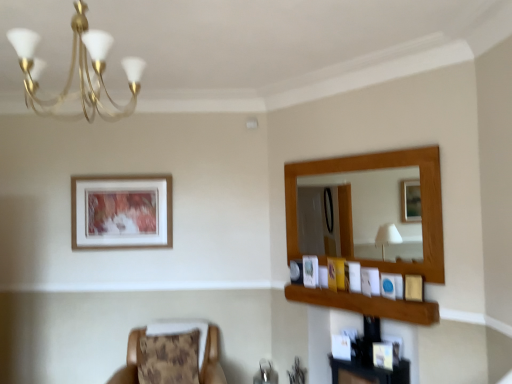
Question: From their relative heights in the image, would you say wooden picture frame at right, marked as the fourth picture frame in a left-to-right arrangement, is taller or shorter than brown textured cushion at lower left?

Choices:
 (A) tall
 (B) short

Answer: (B)

Question: Based on their sizes in the image, would you say wooden picture frame at right, which is the third picture frame in right-to-left order, is bigger or smaller than brown textured cushion at lower left?

Choices:
 (A) big
 (B) small

Answer: (B)

Question: Which is farther from the wooden framed artwork at upper left, acting as the first picture frame starting from the left?

Choices:
 (A) matte gold picture frame at right, arranged as the 1th picture frame when viewed from the front
 (B) gold metallic chandelier at upper left
 (C) matte white picture frame at upper center, placed as the fifth picture frame when sorted from right to left
 (D) brown textured cushion at lower left
 (E) wooden frame at upper right

Answer: (A)

Question: Which is nearer to the matte blue picture frame at upper right, the fifth picture frame positioned from the back?

Choices:
 (A) gold metallic chandelier at upper left
 (B) wooden picture frame at upper right, positioned as the fourth picture frame in right-to-left order
 (C) matte white picture frame at upper center, which is the 2th picture frame in left-to-right order
 (D) wooden frame at upper right
 (E) wooden framed artwork at upper left, positioned as the 1th picture frame in back-to-front order

Answer: (D)